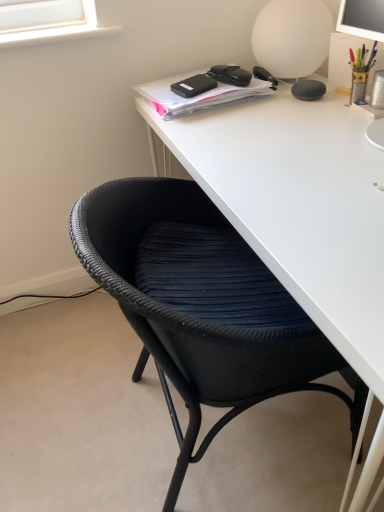
The image size is (384, 512). In order to click on unoccupied area in front of matte black speaker at upper right, placed as the 3th stationery when sorted from left to right in this screenshot , I will do `click(311, 117)`.